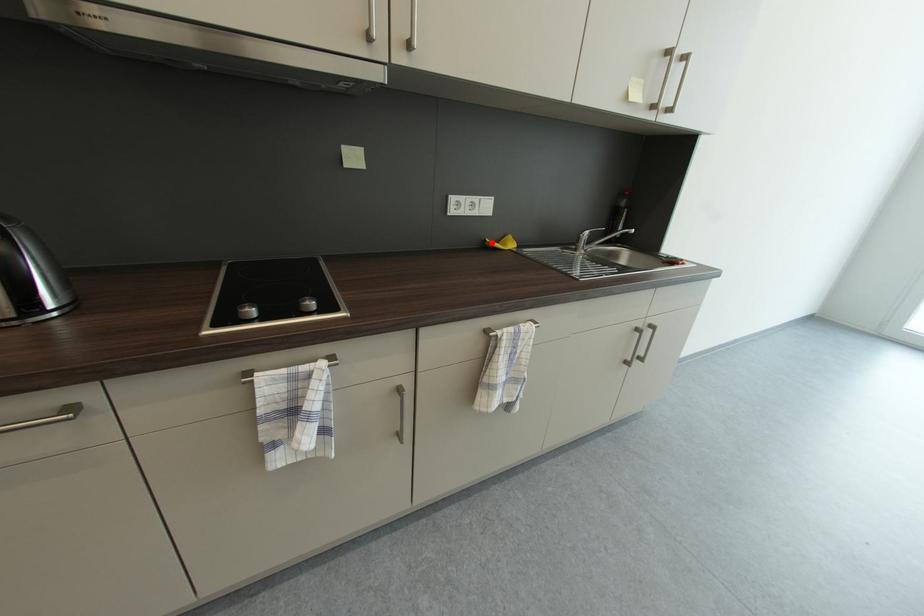
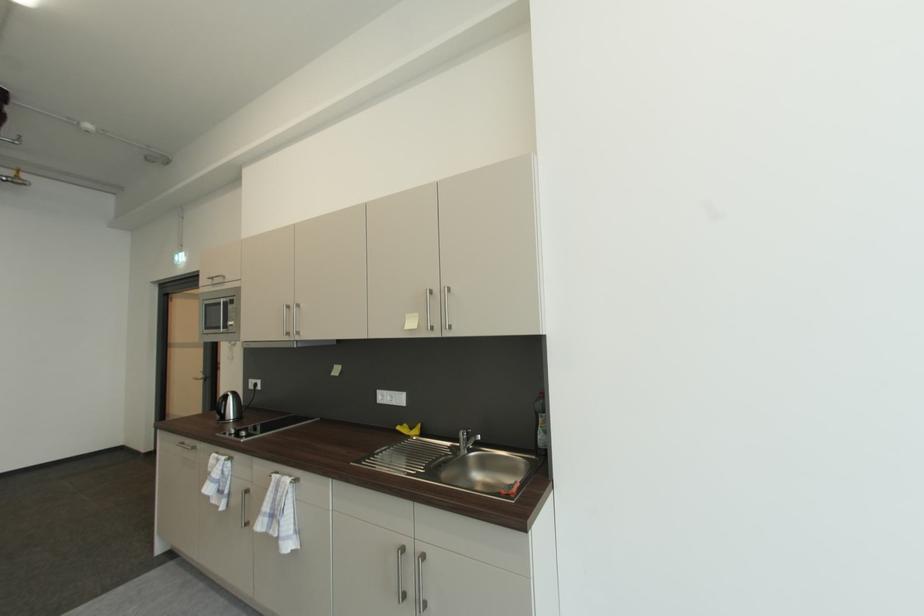
Question: I am providing you with two images of the same scene from different viewpoints. Given a red point in image1, look at the same physical point in image2. Is it:

Choices:
 (A) Closer to the viewpoint
 (B) Farther from the viewpoint

Answer: (B)